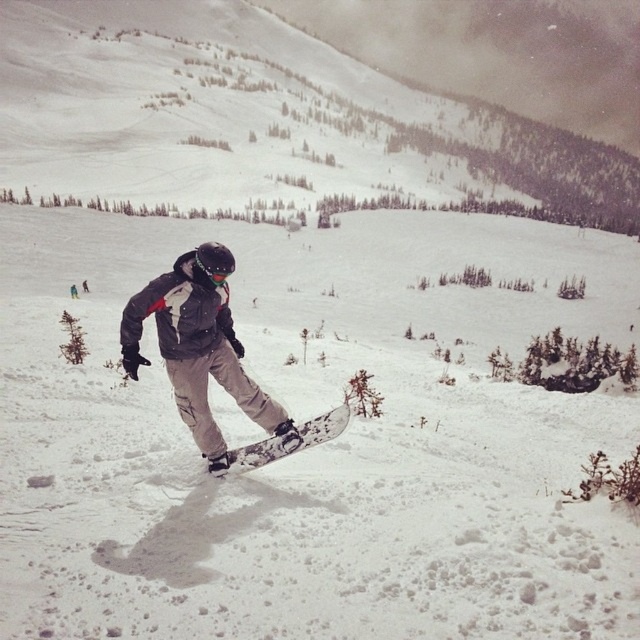
Question: Is matte black snowboard at center thinner than camouflage-patterned snowboard at center?

Choices:
 (A) yes
 (B) no

Answer: (B)

Question: Which object appears farthest from the camera in this image?

Choices:
 (A) matte black snowboard at center
 (B) camouflage-patterned snowboard at center

Answer: (B)

Question: Does matte black snowboard at center come in front of camouflage-patterned snowboard at center?

Choices:
 (A) no
 (B) yes

Answer: (B)

Question: Is matte black snowboard at center above camouflage-patterned snowboard at center?

Choices:
 (A) no
 (B) yes

Answer: (B)

Question: Which point is farther from the camera taking this photo?

Choices:
 (A) (196, 358)
 (B) (346, 424)

Answer: (B)